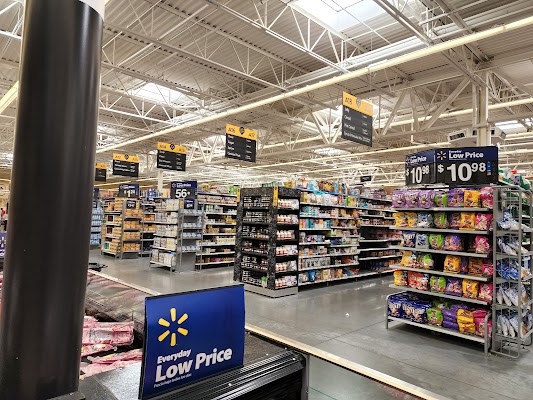
You are a GUI agent. You are given a task and a screenshot of the screen. Output one action in this format:
    pyautogui.click(x=<x>, y=<y>)
    Task: Click on the support column
    Image resolution: width=533 pixels, height=400 pixels.
    Given the screenshot: What is the action you would take?
    pyautogui.click(x=79, y=240)